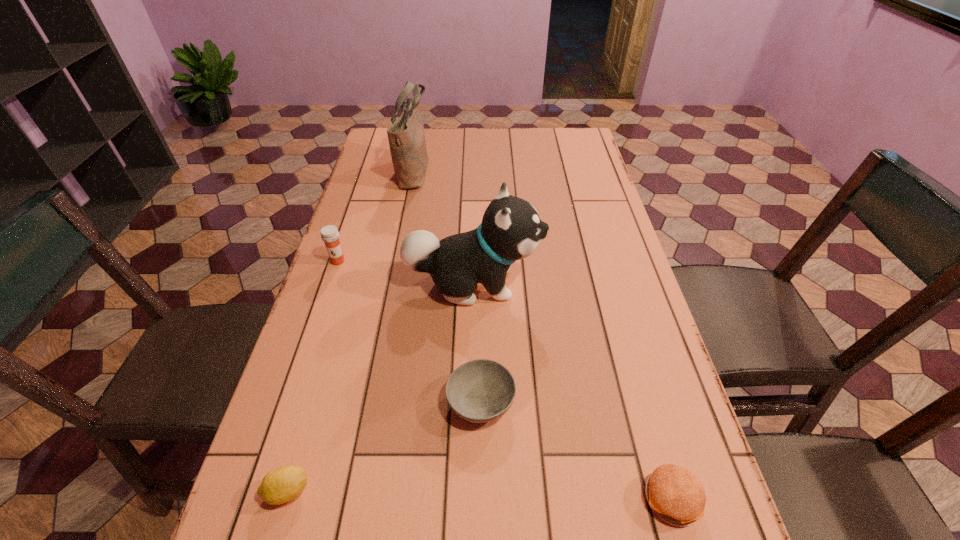
At what (x,y) coordinates should I click in order to perform the action: click on object that ranks as the fourth closest to the puppy. Please return your answer as a coordinate pair (x, y). Looking at the image, I should click on (283, 484).

Find the location of a particular element. free region that satisfies the following two spatial constraints: 1. at the stem end of the lemon; 2. on the left side of the hamburger is located at coordinates 285,498.

At what (x,y) coordinates should I click in order to perform the action: click on vacant area that satisfies the following two spatial constraints: 1. at the face of the rightmost object; 2. on the left side of the puppy. Please return your answer as a coordinate pair (x, y). The height and width of the screenshot is (540, 960). Looking at the image, I should click on (470, 498).

The width and height of the screenshot is (960, 540). Identify the location of free spot that satisfies the following two spatial constraints: 1. at the face of the puppy; 2. on the right side of the bowl. (471, 401).

The width and height of the screenshot is (960, 540). Identify the location of free spot that satisfies the following two spatial constraints: 1. on the front-facing side of the shoulder bag; 2. on the label side of the medicine. (396, 261).

Locate an element on the screen. The height and width of the screenshot is (540, 960). vacant region that satisfies the following two spatial constraints: 1. on the label side of the rightmost object; 2. on the right side of the third tallest object is located at coordinates (258, 498).